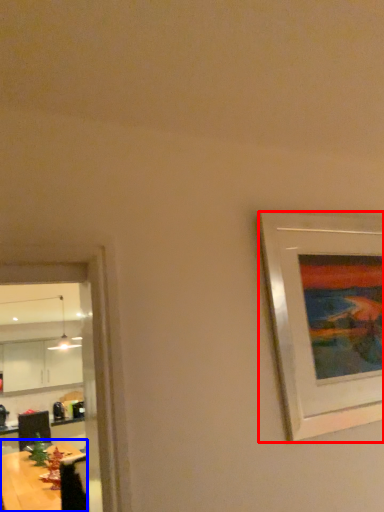
Question: Which point is further to the camera, picture frame (highlighted by a red box) or table (highlighted by a blue box)?

Choices:
 (A) picture frame
 (B) table

Answer: (B)